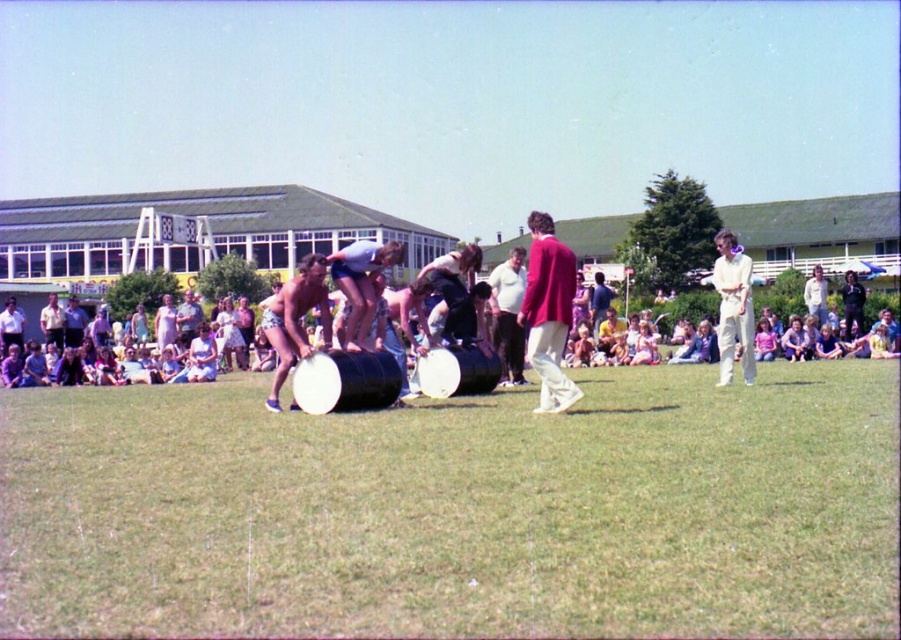
Does black matte barrel at center have a greater height compared to smooth skin at center?

No.

Does black matte barrel at center have a lesser height compared to smooth skin at center?

Yes.

What do you see at coordinates (344, 381) in the screenshot? I see `black matte barrel at center` at bounding box center [344, 381].

At what (x,y) coordinates should I click in order to perform the action: click on black matte barrel at center. Please return your answer as a coordinate pair (x, y). The image size is (901, 640). Looking at the image, I should click on (344, 381).

Who is positioned more to the right, black matte barrel at center or smooth black drum at center?

smooth black drum at center is more to the right.

Who is more distant from viewer, (315, 406) or (428, 369)?

Point (428, 369)

The height and width of the screenshot is (640, 901). What do you see at coordinates (344, 381) in the screenshot? I see `black matte barrel at center` at bounding box center [344, 381].

At what (x,y) coordinates should I click in order to perform the action: click on black matte barrel at center. Please return your answer as a coordinate pair (x, y). The height and width of the screenshot is (640, 901). Looking at the image, I should click on (344, 381).

Is shiny metallic drum at center positioned at the back of smooth skin at center?

No, it is not.

Does shiny metallic drum at center have a lesser width compared to smooth skin at center?

Yes.

Is point (326, 314) in front of point (344, 268)?

Yes, it is in front of point (344, 268).

Where is `shiny metallic drum at center`? shiny metallic drum at center is located at coordinates (296, 320).